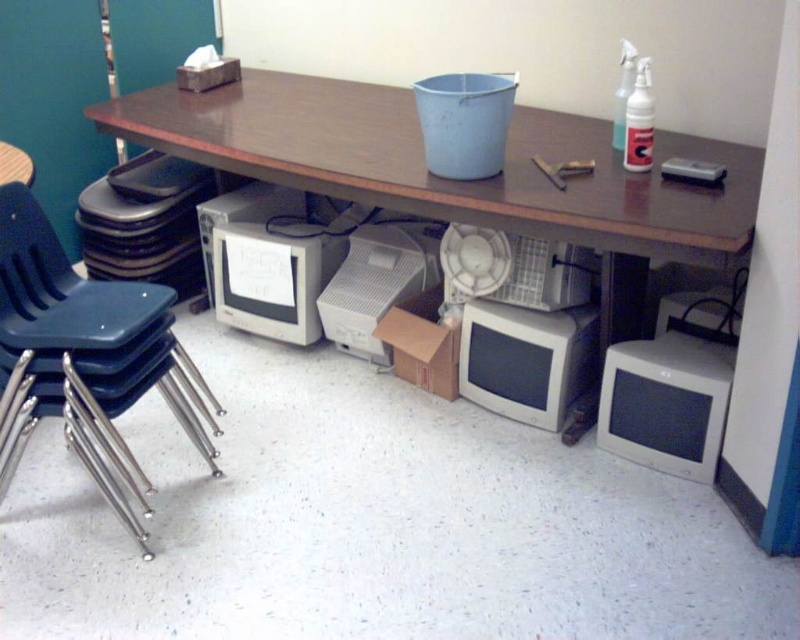
You are standing in front of the workspace shown in the image. You need to place a new object at the exact center of the table. Where should you place it relative to the matte gray monitor at lower center?

The exact center of the table is at point [400,320]. The matte gray monitor at lower center is located at [528,358], so the center of the table is slightly to the left and above the matte gray monitor at lower center.

You are a technician trying to access the white plastic fan at center. The matte gray monitor at lower center is blocking your path. Can you move the monitor to the side to reach the fan?

The matte gray monitor at lower center is only 5.80 inches away from the white plastic fan at center, so there is insufficient space to move the monitor aside and reach the fan.